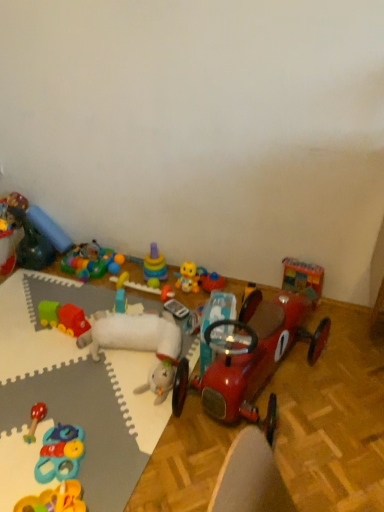
At what (x,y) coordinates should I click in order to perform the action: click on vacant area on the back side of wooden rattle at lower left, the seventh toy viewed from the right. Please return your answer as a coordinate pair (x, y). The height and width of the screenshot is (512, 384). Looking at the image, I should click on (50, 387).